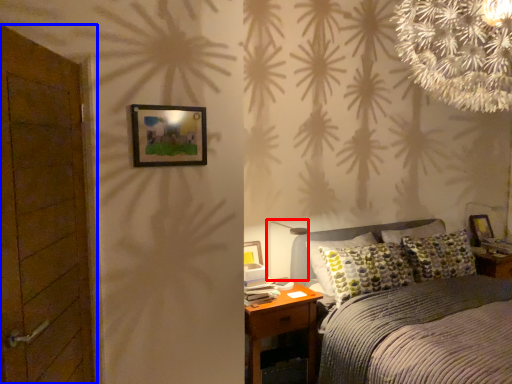
Question: Which of the following is the farthest to the observer, table lamp (highlighted by a red box) or door (highlighted by a blue box)?

Choices:
 (A) table lamp
 (B) door

Answer: (A)